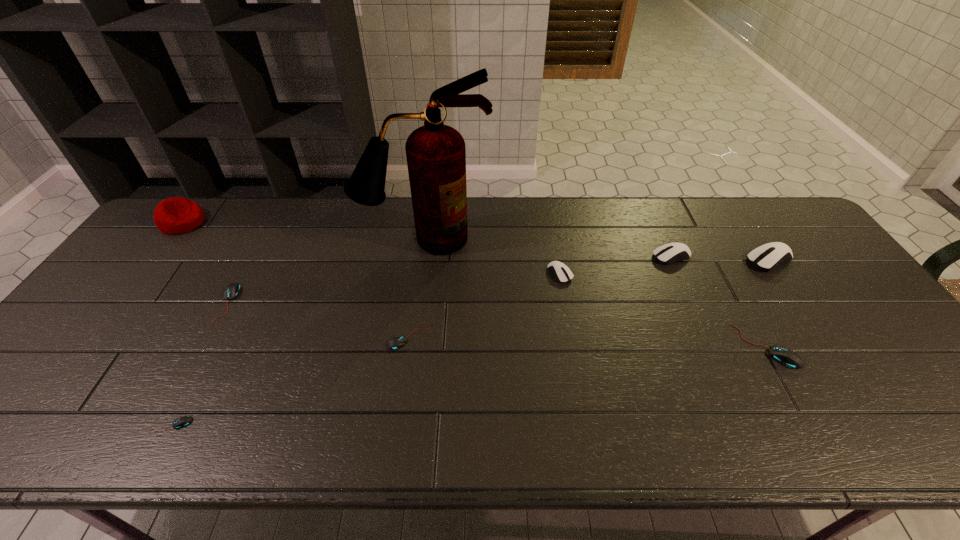
The width and height of the screenshot is (960, 540). Find the location of `red fire extinguisher`. red fire extinguisher is located at coordinates (436, 155).

Identify the location of fire extinguisher. (436, 155).

This screenshot has height=540, width=960. Find the location of `the leftmost object`. the leftmost object is located at coordinates (176, 215).

Where is `beanbag`? beanbag is located at coordinates (176, 215).

The height and width of the screenshot is (540, 960). I want to click on the tallest mouse, so click(765, 257).

Where is `the seventh shortest object`? the seventh shortest object is located at coordinates (765, 257).

Locate an element on the screen. the seventh object from left to right is located at coordinates (668, 253).

At what (x,y) coordinates should I click in order to perform the action: click on the fifth mouse from left to right. Please return your answer as a coordinate pair (x, y). Looking at the image, I should click on (668, 253).

Where is `the third tallest mouse`? the third tallest mouse is located at coordinates (562, 273).

This screenshot has width=960, height=540. I want to click on the fourth mouse from left to right, so click(x=562, y=273).